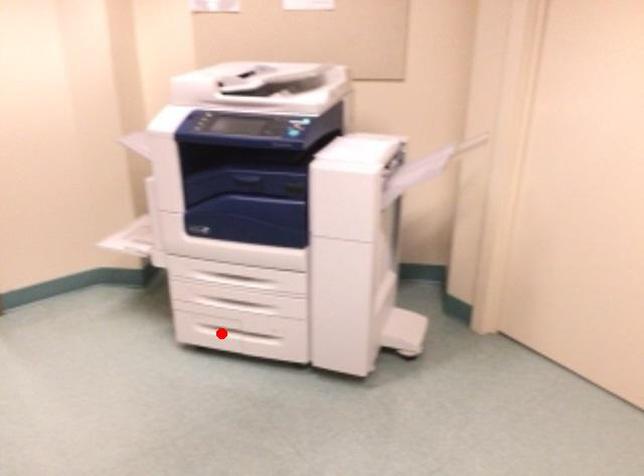
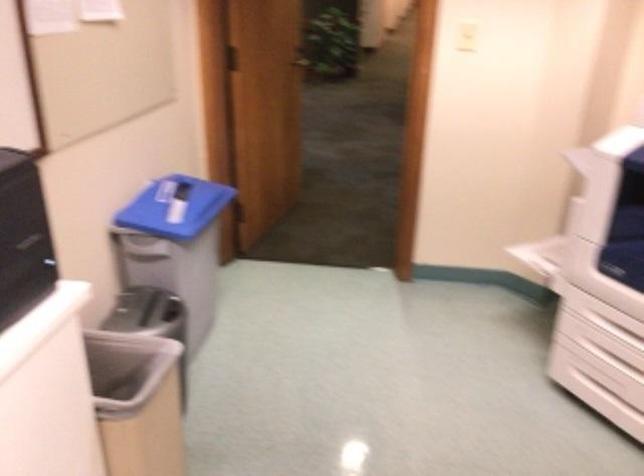
Question: I am providing you with two images of the same scene from different viewpoints. In image1, a red point is highlighted. Considering the same 3D point in image2, which of the following is correct?

Choices:
 (A) It is closer
 (B) It is farther

Answer: (A)